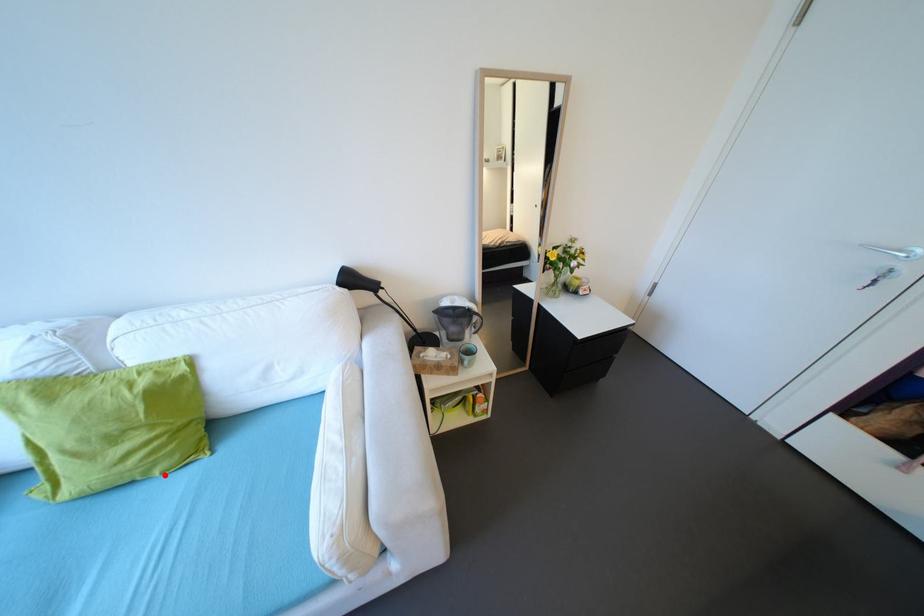
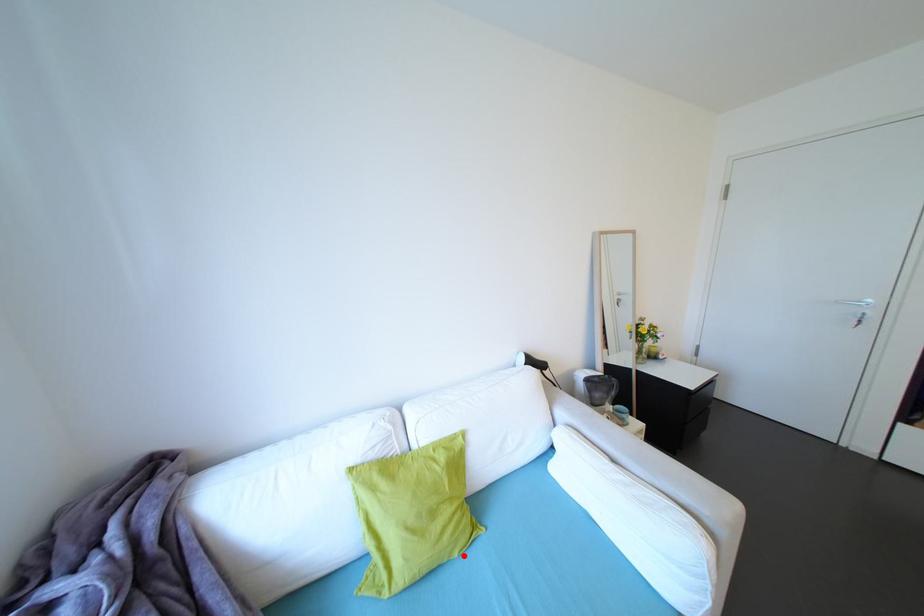
I am providing you with two images of the same scene from different viewpoints. A red point is marked on the first image and another point is marked on the second image. Are the points marked in image1 and image2 representing the same 3D position?

Yes